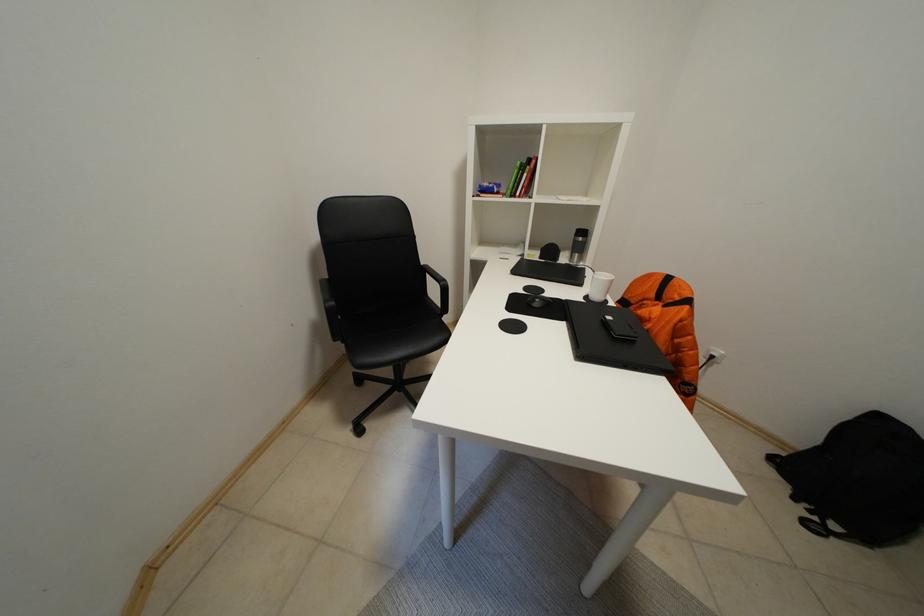
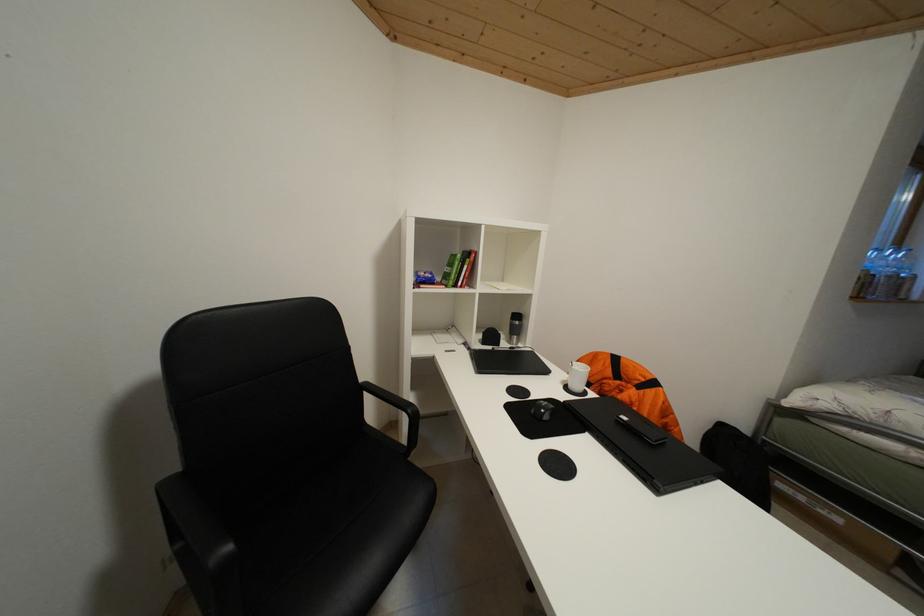
Question: The camera is either moving clockwise (left) or counter-clockwise (right) around the object. The first image is from the beginning of the video and the second image is from the end. Is the camera moving left or right when shooting the video?

Choices:
 (A) Left
 (B) Right

Answer: (A)